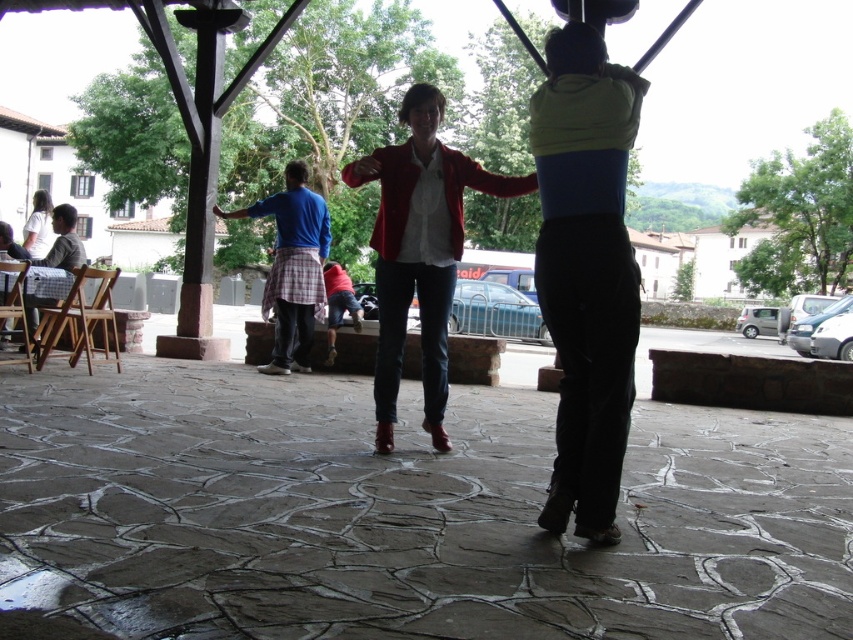
You are a photographer standing at the back of the pergola and want to capture both the matte yellow top at center and the blue cotton shirt at center in a single photo. Which one should you focus on first to ensure both are in sharp focus?

The matte yellow top at center is closer to the viewer than the blue cotton shirt at center, so you should focus on the matte yellow top at center first to ensure both are in sharp focus.

You are a photographer at the event and want to capture both the checkered fabric shirt at left and the white matte shirt at upper left in a single photo. Which shirt should you focus on to ensure both are in sharp focus?

You should focus on the checkered fabric shirt at left because it is closer to the viewer than the white matte shirt at upper left, so focusing on the closer one will keep both in focus.

You are a photographer standing at the back of the wooden pergola. You want to take a photo that includes both the matte red blazer at center and the checkered fabric shirt at left. Based on their positions, which object should you adjust your camera angle to focus on first to ensure both are in frame?

The matte red blazer at center is located above the checkered fabric shirt at left, so you should adjust your camera angle to focus on the matte red blazer at center first to ensure both are in frame.